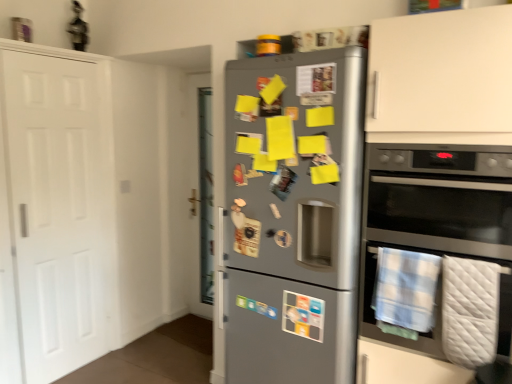
The image size is (512, 384). What are the coordinates of `free space above white matte door at left (from a real-world perspective)` in the screenshot? It's located at (57, 54).